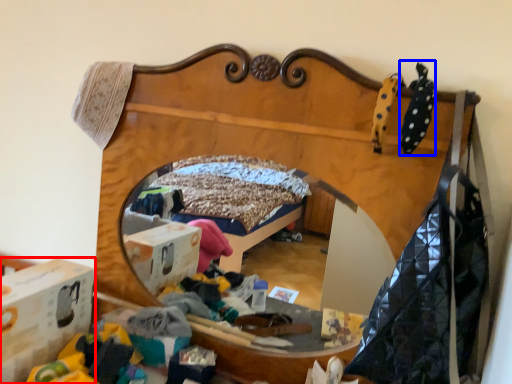
Question: Which of the following is the closest to the observer, cardboard box (highlighted by a red box) or clothing (highlighted by a blue box)?

Choices:
 (A) cardboard box
 (B) clothing

Answer: (B)